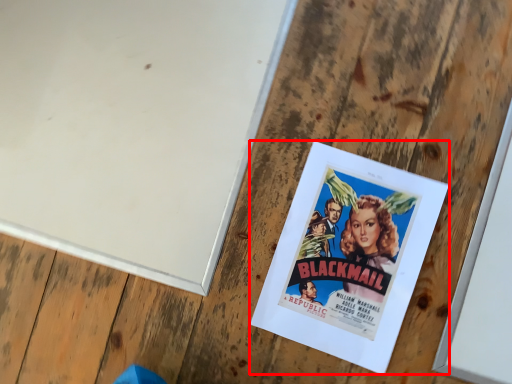
Question: From the image's perspective, what is the correct spatial relationship of poster (annotated by the red box) in relation to bulletin board?

Choices:
 (A) below
 (B) above

Answer: (A)